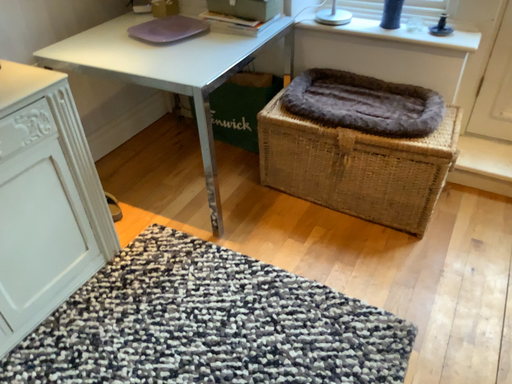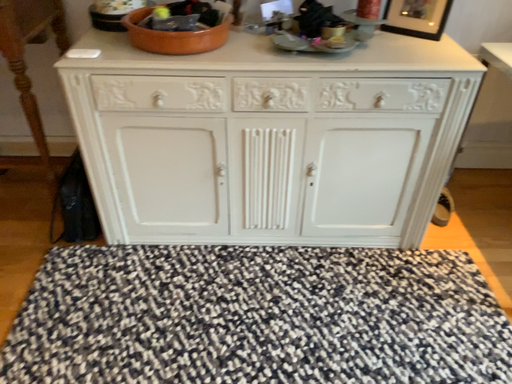
Question: Which way did the camera rotate in the video?

Choices:
 (A) rotated left
 (B) rotated right

Answer: (A)